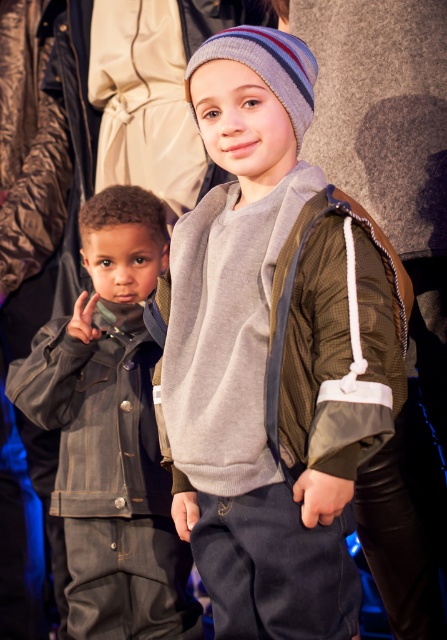
Question: Does gray fleece sweatshirt at center have a larger size compared to denim jacket at left?

Choices:
 (A) yes
 (B) no

Answer: (A)

Question: Which object is the farthest from the gray cotton sweatshirt at left?

Choices:
 (A) striped knit beanie at upper center
 (B) denim jacket at left

Answer: (A)

Question: Which point is closer to the camera taking this photo?

Choices:
 (A) (279, 81)
 (B) (123, 211)

Answer: (A)

Question: Does denim jacket at left come behind striped knit beanie at upper center?

Choices:
 (A) no
 (B) yes

Answer: (B)

Question: Among these objects, which one is farthest from the camera?

Choices:
 (A) gray fleece sweatshirt at center
 (B) denim jacket at left
 (C) gray cotton sweatshirt at left

Answer: (C)

Question: Is gray cotton sweatshirt at left below striped knit beanie at upper center?

Choices:
 (A) no
 (B) yes

Answer: (B)